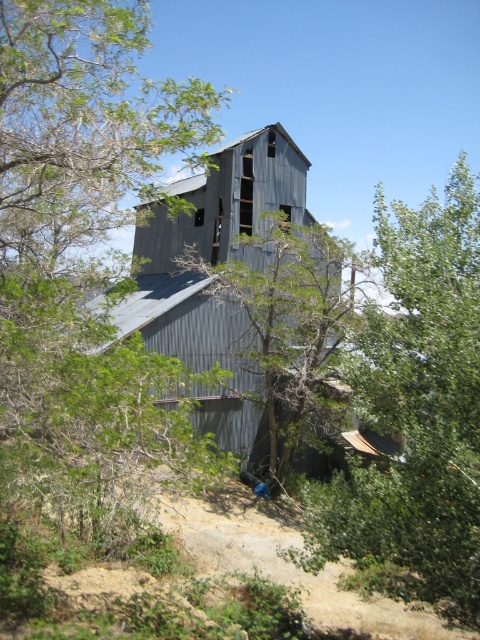
Is green leafy tree at right taller than rusty corrugated metal barn at center?

Yes, green leafy tree at right is taller than rusty corrugated metal barn at center.

Does green leafy tree at right have a larger size compared to rusty corrugated metal barn at center?

Indeed, green leafy tree at right has a larger size compared to rusty corrugated metal barn at center.

Image resolution: width=480 pixels, height=640 pixels. What do you see at coordinates (416, 412) in the screenshot? I see `green leafy tree at right` at bounding box center [416, 412].

The image size is (480, 640). What are the coordinates of `green leafy tree at right` in the screenshot? It's located at (416, 412).

Is green leafy tree at right shorter than green leafy tree at center?

In fact, green leafy tree at right may be taller than green leafy tree at center.

Based on the photo, can you confirm if green leafy tree at right is taller than green leafy tree at center?

Yes, green leafy tree at right is taller than green leafy tree at center.

Is point (425, 392) closer to viewer compared to point (291, 428)?

Yes, point (425, 392) is in front of point (291, 428).

At what (x,y) coordinates should I click in order to perform the action: click on green leafy tree at right. Please return your answer as a coordinate pair (x, y). Looking at the image, I should click on pyautogui.click(x=416, y=412).

Is rusty corrugated metal barn at center wider than green leafy tree at center?

Yes, rusty corrugated metal barn at center is wider than green leafy tree at center.

Between rusty corrugated metal barn at center and green leafy tree at center, which one has more height?

rusty corrugated metal barn at center is taller.

The image size is (480, 640). What do you see at coordinates (212, 276) in the screenshot? I see `rusty corrugated metal barn at center` at bounding box center [212, 276].

Where is `rusty corrugated metal barn at center`? The image size is (480, 640). rusty corrugated metal barn at center is located at coordinates (212, 276).